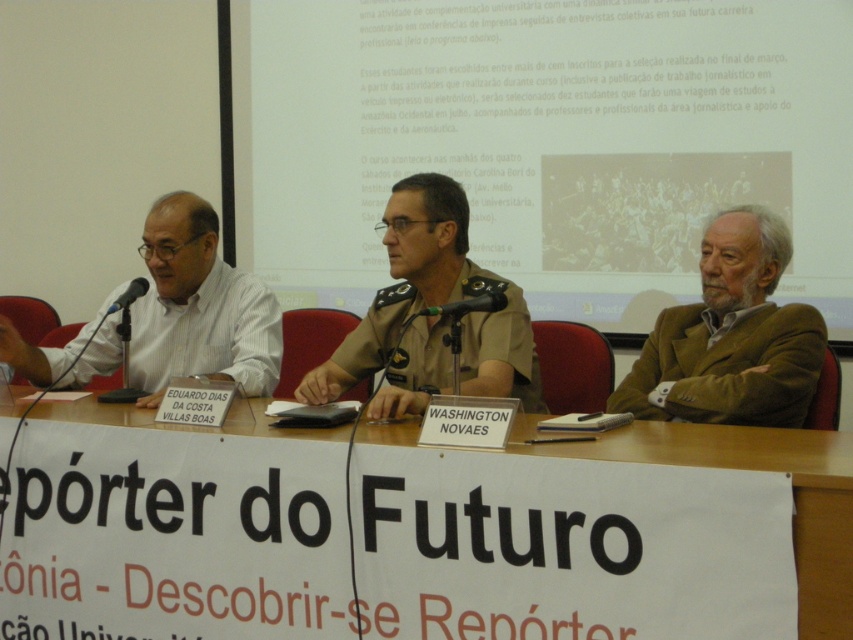
Question: Which object is farther from the camera taking this photo?

Choices:
 (A) matte white shirt at left
 (B) brown woolen jacket at right
 (C) green matte microphone at center
 (D) white paperboard at center

Answer: (A)

Question: Which is farther from the white paperboard at center?

Choices:
 (A) matte black microphone at left
 (B) matte white shirt at left
 (C) brown woolen jacket at right
 (D) green matte microphone at center

Answer: (A)

Question: Can you confirm if white paperboard at center is wider than green matte microphone at center?

Choices:
 (A) no
 (B) yes

Answer: (B)

Question: Does white paperboard at center appear under matte white shirt at left?

Choices:
 (A) yes
 (B) no

Answer: (A)

Question: Is matte white shirt at left below green matte microphone at center?

Choices:
 (A) no
 (B) yes

Answer: (B)

Question: Which object appears farthest from the camera in this image?

Choices:
 (A) brown woolen jacket at right
 (B) matte black microphone at left
 (C) matte white shirt at left

Answer: (C)